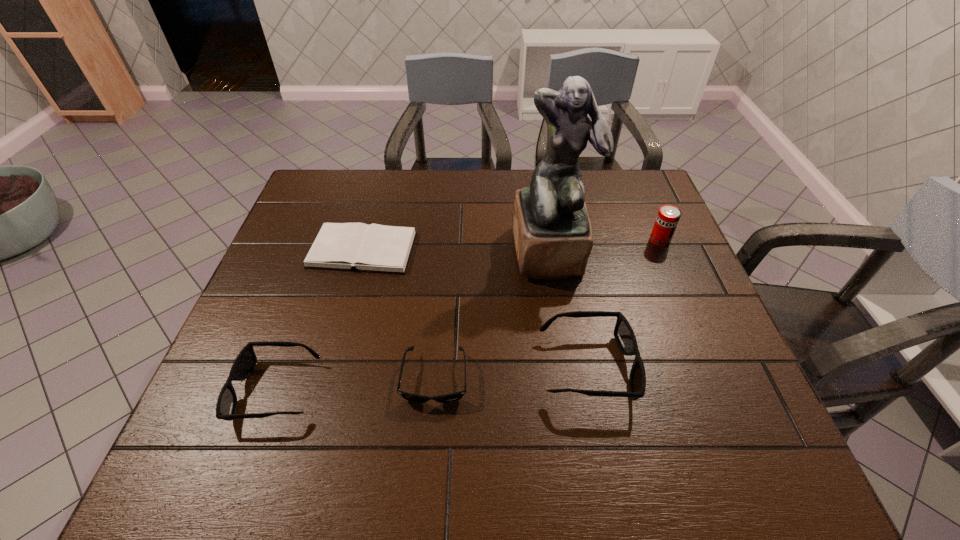
Identify the location of free location at the left edge of the desktop. The height and width of the screenshot is (540, 960). (318, 298).

Find the location of a particular element. The image size is (960, 540). vacant region at the right edge of the desktop is located at coordinates (656, 269).

What are the coordinates of `vacant area at the far left corner of the desktop` in the screenshot? It's located at (351, 198).

Where is `blank area at the far right corner`? blank area at the far right corner is located at coordinates (609, 177).

The image size is (960, 540). I want to click on unoccupied position between the third shortest object and the rightmost object, so click(x=468, y=315).

The height and width of the screenshot is (540, 960). Identify the location of empty space that is in between the third object from left to right and the can. (547, 309).

I want to click on free space that is in between the second sunglasses from left to right and the tallest object, so click(492, 315).

You are a GUI agent. You are given a task and a screenshot of the screen. Output one action in this format:
    pyautogui.click(x=<x>, y=<y>)
    Task: Click on the empty space between the tallest object and the rightmost sunglasses
    
    Given the screenshot: What is the action you would take?
    pyautogui.click(x=569, y=309)

Image resolution: width=960 pixels, height=540 pixels. I want to click on free space between the hardback book and the rightmost sunglasses, so click(x=475, y=308).

The image size is (960, 540). I want to click on unoccupied area between the shortest sunglasses and the can, so click(547, 309).